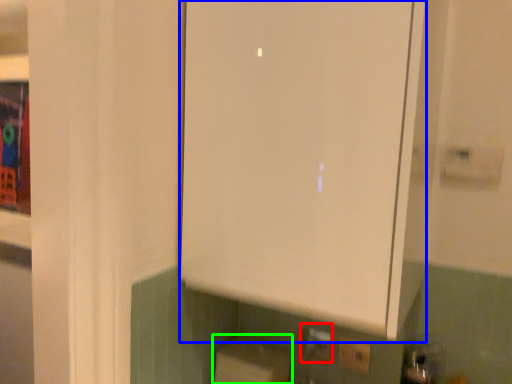
Question: Based on their relative distances, which object is farther from electric outlet (highlighted by a red box)? Choose from cabinetry (highlighted by a blue box) and cardboard box (highlighted by a green box).

Choices:
 (A) cabinetry
 (B) cardboard box

Answer: (A)